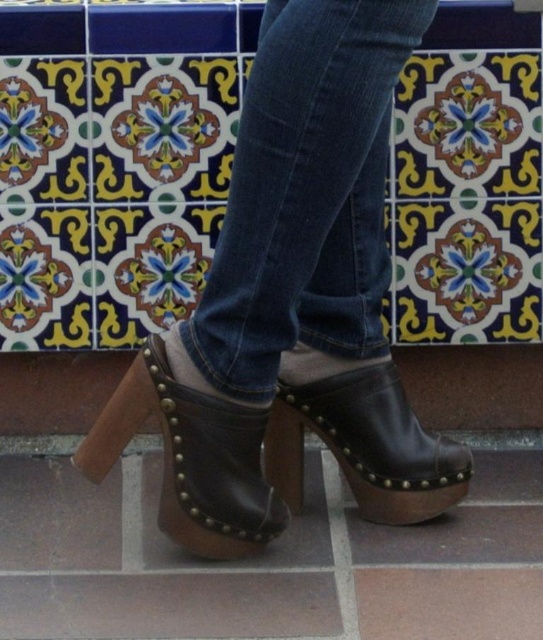
You are standing in a room with a vibrant tiled wall. You notice the leather clog at lower center and the brown wooden tile at lower center. Which object is closer to you?

The leather clog at lower center is closer to you because the brown wooden tile at lower center is behind it.

You are a photographer setting up a shoot. You want to ensure that the brown wooden tile at lower center is visible in the background behind the brown leather clog at center. Based on the scene, will this arrangement be possible?

The brown wooden tile at lower center is behind the brown leather clog at center, so yes, the arrangement will allow the brown wooden tile at lower center to be visible in the background behind the brown leather clog at center.

You are a shoemaker trying to fit a new pair of clogs into a display case. The display case has a slot that matches the width of the brown wooden tile at lower center. Will the leather clog at lower center fit into this slot?

The leather clog at lower center might be wider than the brown wooden tile at lower center, so it may not fit into the slot designed for the tile.